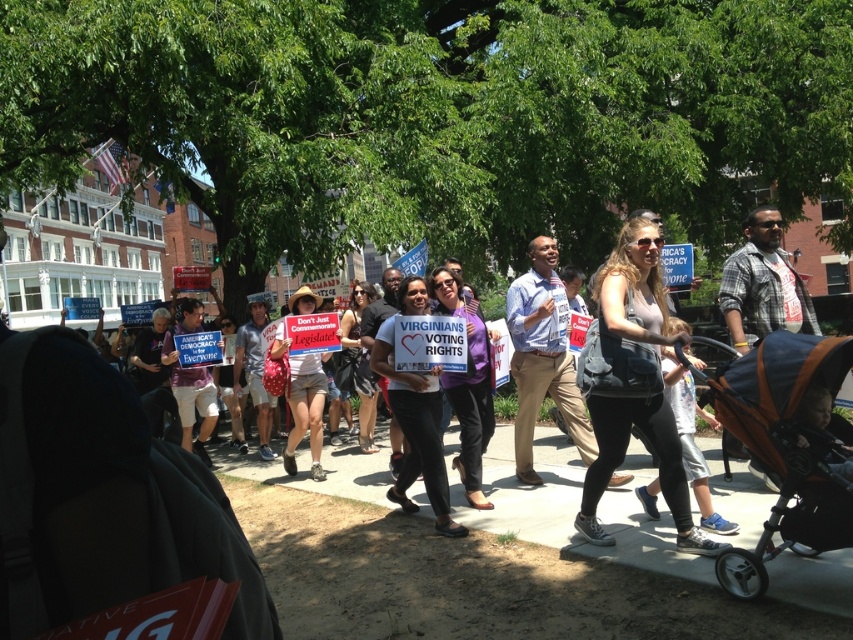
Question: Among these objects, which one is nearest to the camera?

Choices:
 (A) orange fabric stroller at lower right
 (B) denim jacket at center
 (C) denim shorts at center

Answer: (A)

Question: Can you confirm if denim jacket at center is positioned below denim shorts at center?

Choices:
 (A) yes
 (B) no

Answer: (B)

Question: Does purple fabric sign at center appear on the left side of denim shorts at center?

Choices:
 (A) no
 (B) yes

Answer: (A)

Question: Which point is closer to the camera taking this photo?

Choices:
 (A) (422, 460)
 (B) (618, 451)
 (C) (310, 356)
 (D) (790, 342)

Answer: (D)

Question: Which point is closer to the camera?

Choices:
 (A) orange fabric stroller at lower right
 (B) purple fabric sign at center
 (C) denim shorts at center
 (D) denim jacket at center

Answer: (A)

Question: Is denim jacket at center below denim shorts at center?

Choices:
 (A) no
 (B) yes

Answer: (A)